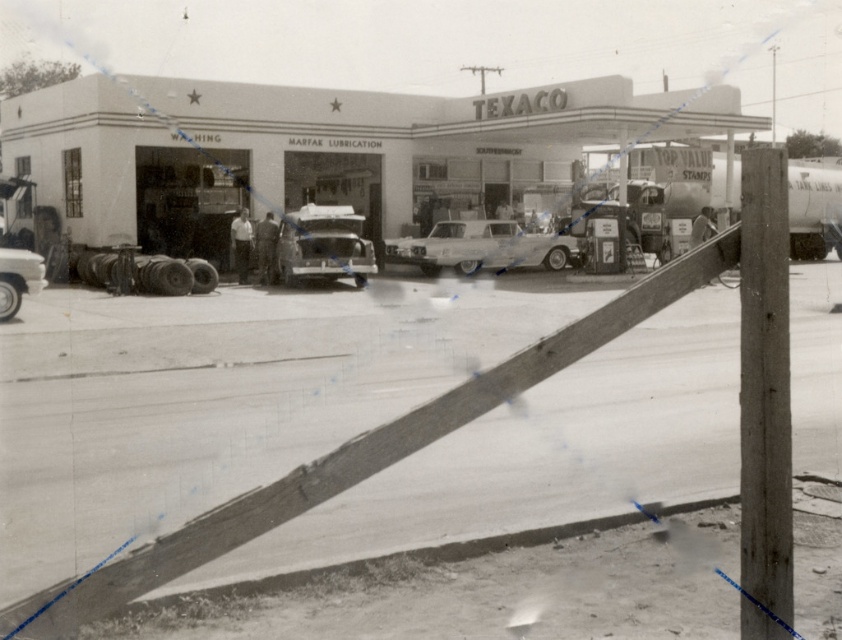
Does shiny silver sedan at center have a lesser height compared to shiny silver car at lower left?

Yes.

Where is `shiny silver sedan at center`? shiny silver sedan at center is located at coordinates (481, 248).

The image size is (842, 640). In order to click on shiny silver sedan at center in this screenshot , I will do `click(481, 248)`.

What do you see at coordinates (316, 150) in the screenshot?
I see `white concrete building at center` at bounding box center [316, 150].

Who is lower down, white concrete building at center or shiny chrome car at center?

shiny chrome car at center

Is point (60, 218) positioned in front of point (342, 227)?

No, (60, 218) is further to viewer.

Find the location of a particular element. white concrete building at center is located at coordinates (316, 150).

Does white concrete building at center appear on the right side of shiny silver car at lower left?

Correct, you'll find white concrete building at center to the right of shiny silver car at lower left.

Consider the image. Is white concrete building at center positioned at the back of shiny silver car at lower left?

Yes, it is behind shiny silver car at lower left.

Is point (504, 113) behind point (14, 285)?

That is True.

The height and width of the screenshot is (640, 842). I want to click on white concrete building at center, so click(x=316, y=150).